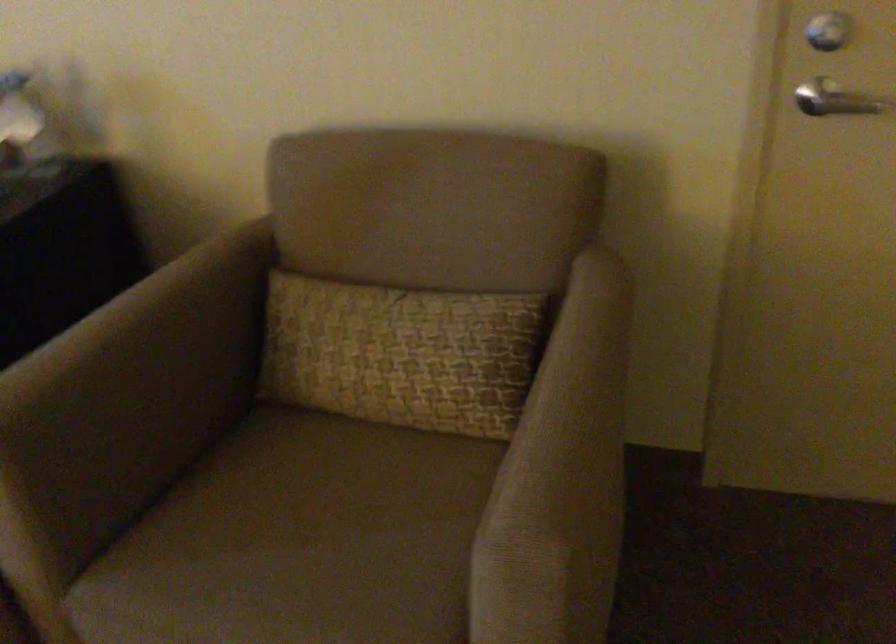
What are the coordinates of `door lock knob` in the screenshot? It's located at (829, 31).